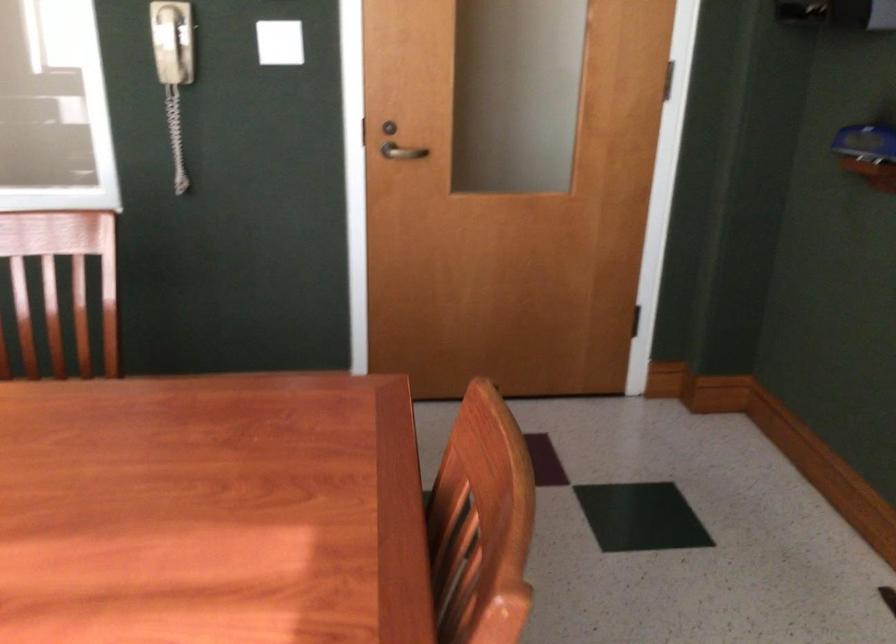
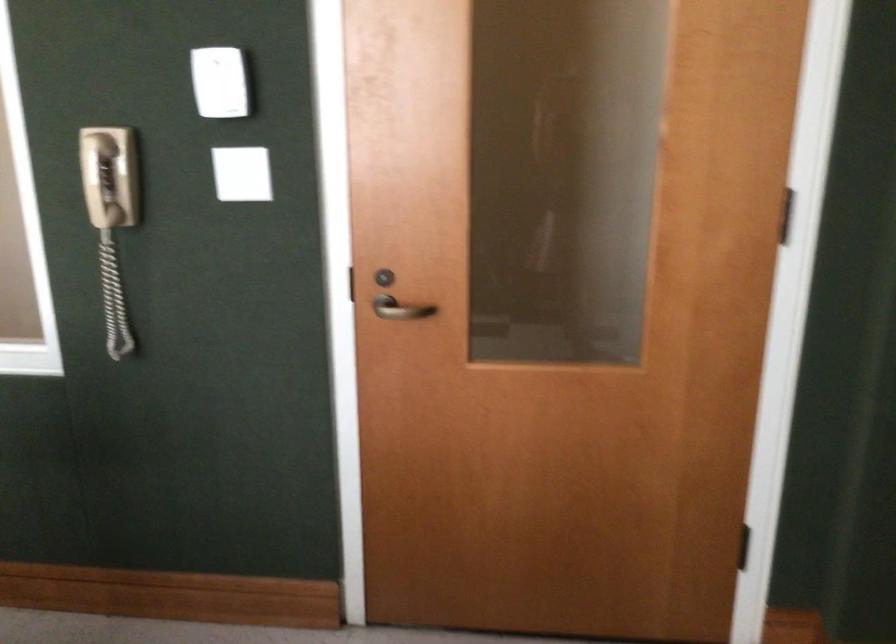
What movement of the cameraman would produce the second image?

The cameraman walked toward right, forward.